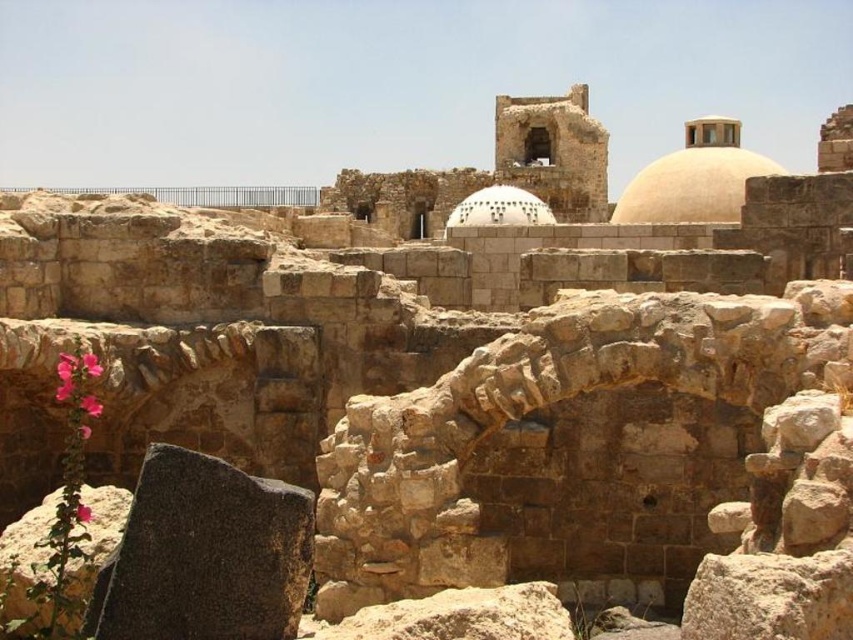
Question: Is beige stone dome at upper center to the left of white stone dome at center from the viewer's perspective?

Choices:
 (A) yes
 (B) no

Answer: (B)

Question: Which of the following is the farthest from the observer?

Choices:
 (A) (508, 189)
 (B) (695, 186)

Answer: (A)

Question: Is beige stone dome at upper center below white stone dome at center?

Choices:
 (A) no
 (B) yes

Answer: (A)

Question: Which point is farther to the camera?

Choices:
 (A) click(671, 157)
 (B) click(477, 202)

Answer: (B)

Question: Can you confirm if beige stone dome at upper center is positioned to the left of white stone dome at center?

Choices:
 (A) no
 (B) yes

Answer: (A)